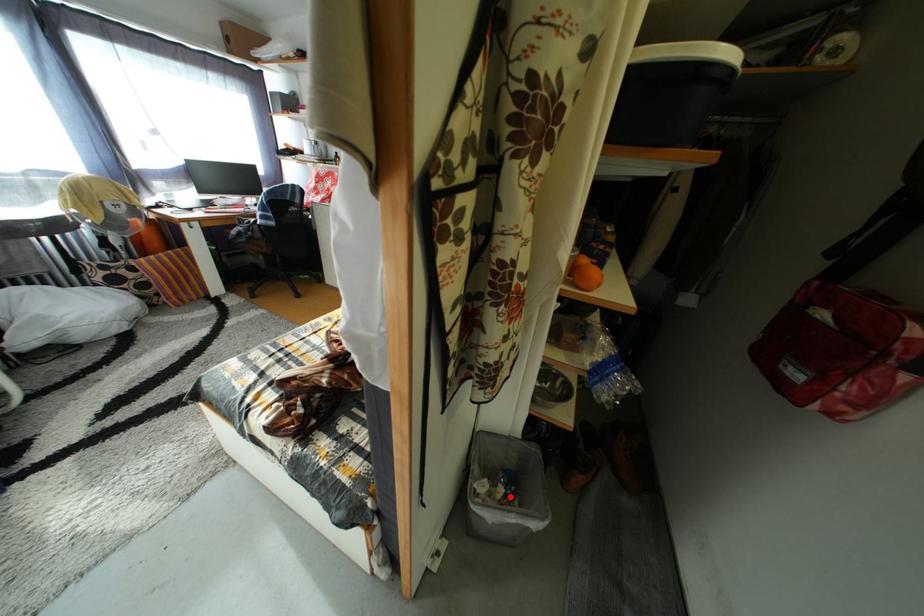
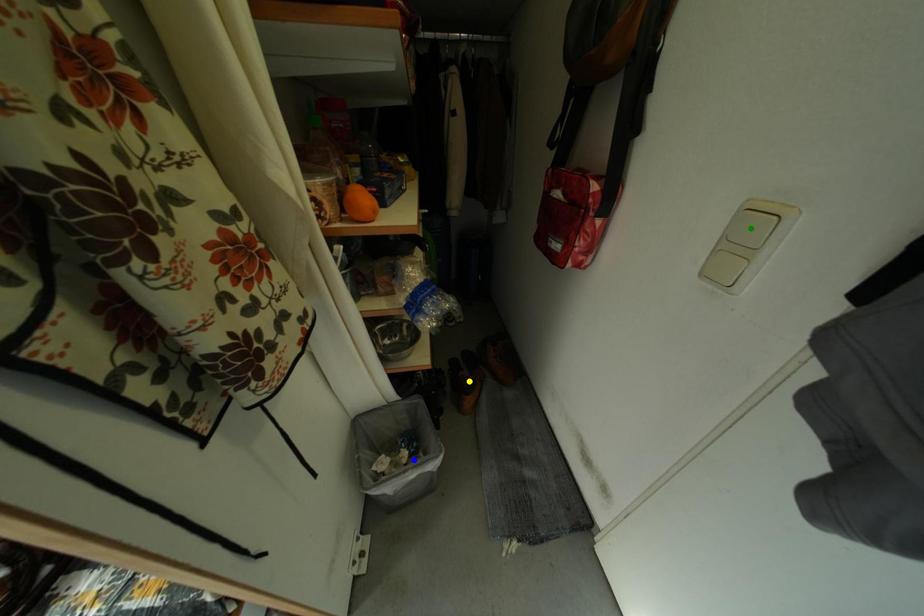
Question: I am providing you with two images of the same scene from different viewpoints. A red point is marked on the first image. You are given multiple points on the second image. Which point in image 2 represents the same 3d spot as the red point in image 1?

Choices:
 (A) blue point
 (B) yellow point
 (C) green point

Answer: (A)